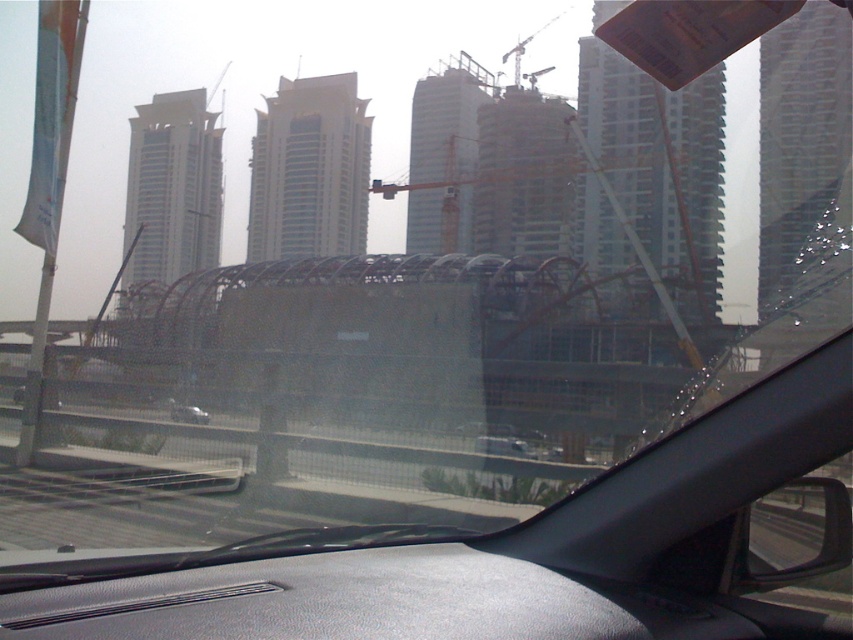
Question: Can you confirm if gray textured dashboard at center is smaller than white matte car at center?

Choices:
 (A) yes
 (B) no

Answer: (B)

Question: Which object is the farthest from the gray textured dashboard at center?

Choices:
 (A) silver metallic car at center
 (B) white matte car at center

Answer: (A)

Question: Can you confirm if gray textured dashboard at center is positioned above white matte car at center?

Choices:
 (A) no
 (B) yes

Answer: (B)

Question: From the image, what is the correct spatial relationship of gray textured dashboard at center in relation to white matte car at center?

Choices:
 (A) left
 (B) right

Answer: (A)

Question: Which of these objects is positioned closest to the gray textured dashboard at center?

Choices:
 (A) silver metallic car at center
 (B) white matte car at center

Answer: (B)

Question: Which object is the closest to the white matte car at center?

Choices:
 (A) gray textured dashboard at center
 (B) silver metallic car at center

Answer: (B)